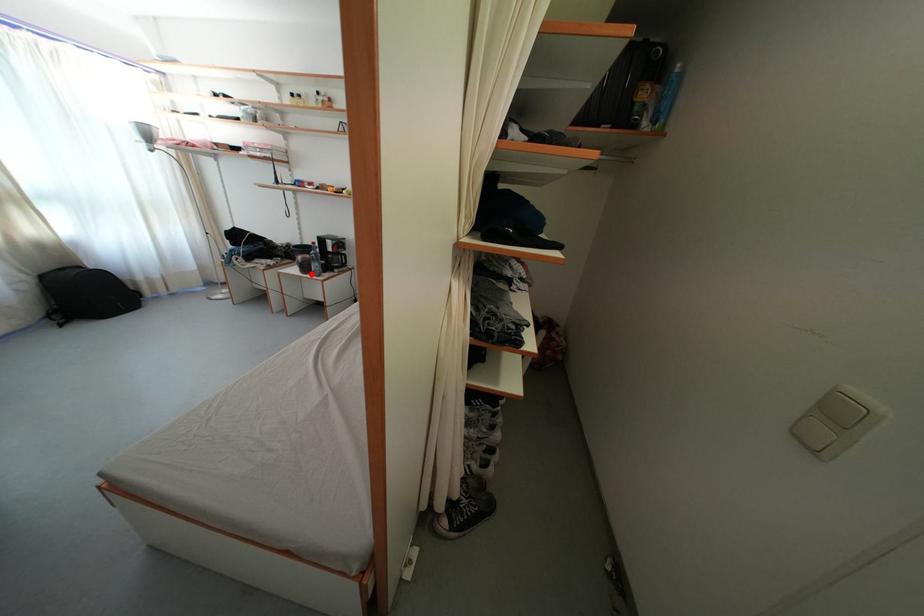
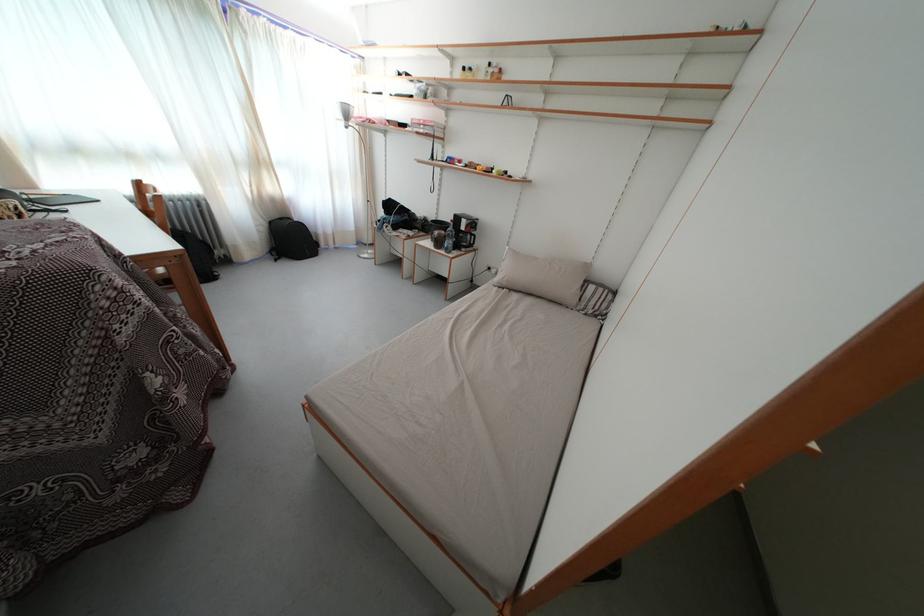
The point at the highlighted location is marked in the first image. Where is the corresponding point in the second image?

(444, 249)